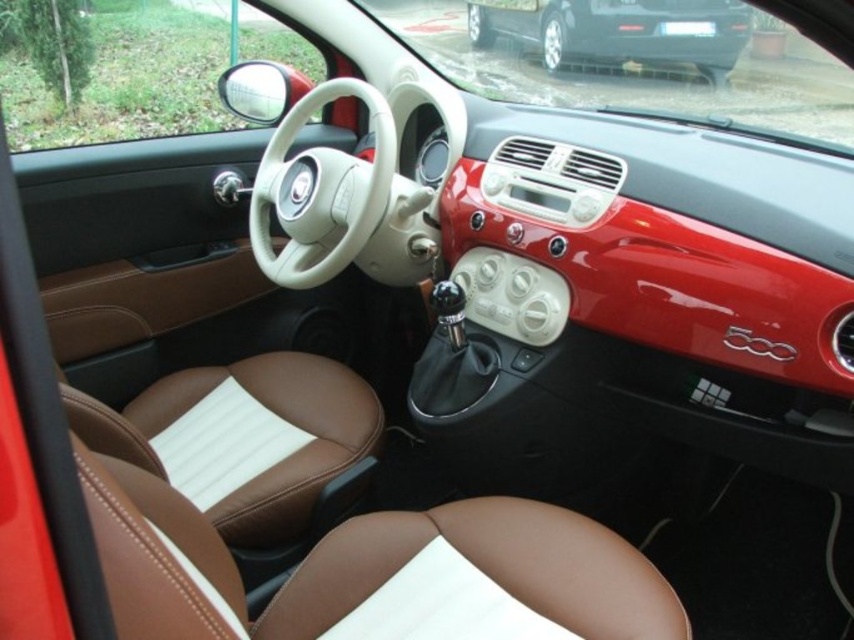
Question: Which point is farther to the camera?

Choices:
 (A) (541, 58)
 (B) (294, 218)

Answer: (A)

Question: Can you confirm if leather/smooth steering wheel at center is wider than matte black car at upper center?

Choices:
 (A) yes
 (B) no

Answer: (B)

Question: Does leather/smooth steering wheel at center have a lesser width compared to matte black car at upper center?

Choices:
 (A) no
 (B) yes

Answer: (B)

Question: Among these objects, which one is nearest to the camera?

Choices:
 (A) leather/smooth steering wheel at center
 (B) matte black car at upper center

Answer: (A)

Question: Is leather/smooth steering wheel at center closer to the viewer compared to matte black car at upper center?

Choices:
 (A) no
 (B) yes

Answer: (B)

Question: Among these points, which one is nearest to the camera?

Choices:
 (A) (301, 179)
 (B) (477, 22)

Answer: (A)